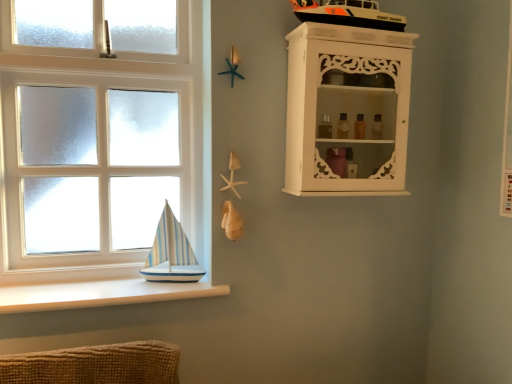
The height and width of the screenshot is (384, 512). What are the coordinates of `vacant space positioned to the left of striped sailboat at window sill` in the screenshot? It's located at point(119,280).